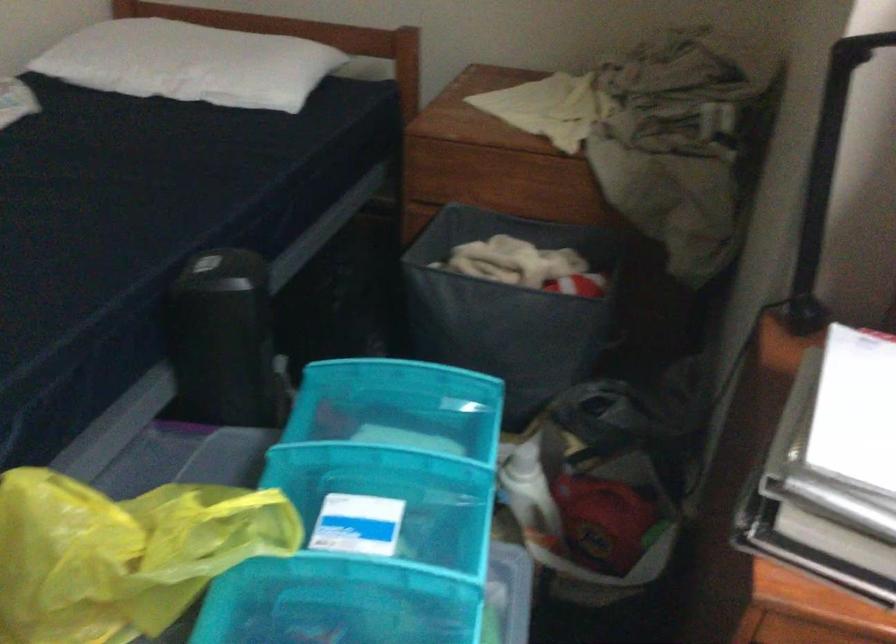
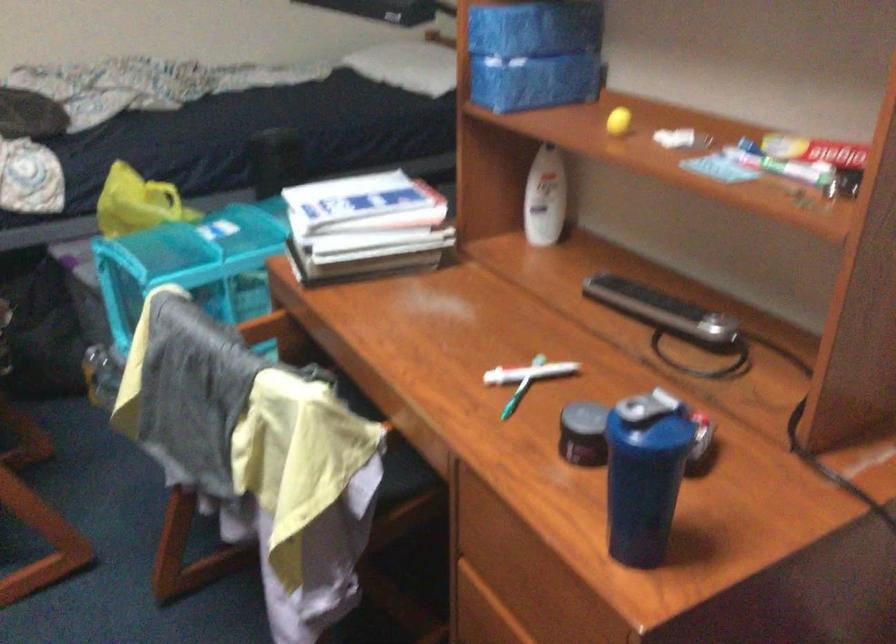
In the second image, find the point that corresponds to (x=395, y=567) in the first image.

(205, 239)